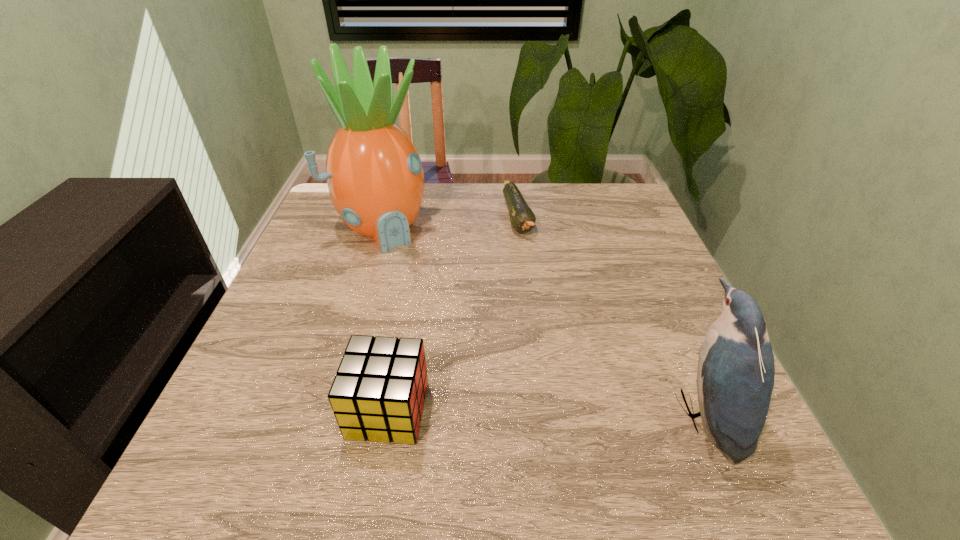
Find the location of a particular element. The height and width of the screenshot is (540, 960). vacant space on the desktop that is between the cube and the rightmost object and is positioned at the entrance of the pineapple is located at coordinates (522, 411).

Locate an element on the screen. This screenshot has width=960, height=540. free spot on the desktop that is between the third tallest object and the rightmost object and is positioned at the blossom end of the shortest object is located at coordinates (578, 412).